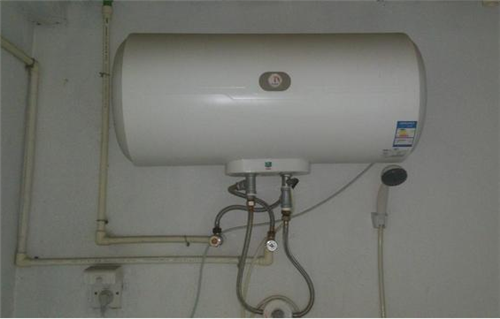
I want to click on cable, so click(197, 302).